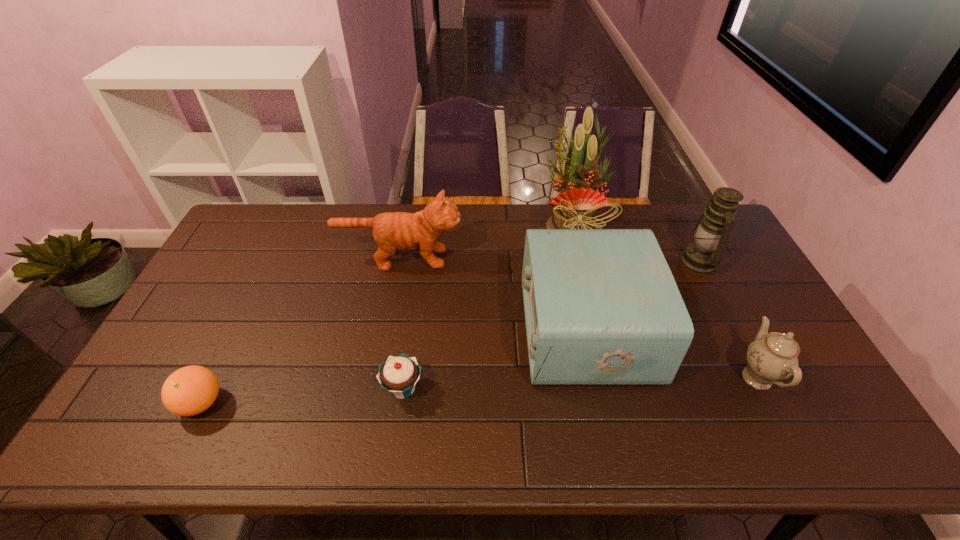
Find the location of a particular element. This screenshot has height=540, width=960. blank space at the far left corner of the desktop is located at coordinates (256, 245).

In order to click on vacant space at the near right corner of the desktop in this screenshot , I will do `click(803, 431)`.

You are a GUI agent. You are given a task and a screenshot of the screen. Output one action in this format:
    pyautogui.click(x=<x>, y=<y>)
    Task: Click on the free space between the cupcake and the orange
    The width and height of the screenshot is (960, 540).
    Given the screenshot: What is the action you would take?
    pyautogui.click(x=301, y=395)

Locate an element on the screen. unoccupied position between the tallest object and the orange is located at coordinates (387, 314).

In order to click on unoccupied area between the chinaware and the leftmost object in this screenshot , I will do `click(479, 390)`.

Where is `unoccupied area between the leftmost object and the fifth tallest object`? Image resolution: width=960 pixels, height=540 pixels. unoccupied area between the leftmost object and the fifth tallest object is located at coordinates (479, 390).

The width and height of the screenshot is (960, 540). I want to click on free space between the oil lamp and the third shortest object, so click(x=729, y=320).

Locate an element on the screen. empty location between the cat and the leftmost object is located at coordinates (300, 330).

Locate an element on the screen. the second closest object to the radio receiver is located at coordinates (710, 235).

Locate an element on the screen. The width and height of the screenshot is (960, 540). the third closest object to the cupcake is located at coordinates (188, 391).